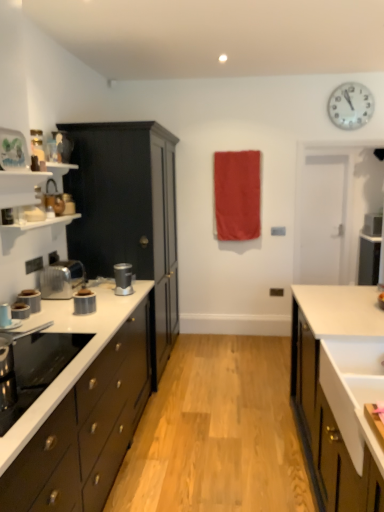
Question: Do you think matte black cabinet at left, arranged as the 2th cabinetry when viewed from the right, is within white glossy clock at upper right, or outside of it?

Choices:
 (A) outside
 (B) inside

Answer: (A)

Question: Is matte black cabinet at left, arranged as the 2th cabinetry when viewed from the right, wider or thinner than white glossy clock at upper right?

Choices:
 (A) thin
 (B) wide

Answer: (B)

Question: Estimate the real-world distances between objects in this image. Which object is closer to the white matte sink at right, positioned as the first cabinetry in right-to-left order?

Choices:
 (A) metallic silver toaster at left, which is the second kitchen appliance from front to back
 (B) matte black cabinet at left, placed as the 2th cabinetry when sorted from left to right
 (C) matte black cabinets at left, the 1th cabinetry from the left
 (D) metallic silver tape at left, arranged as the third kitchen appliance when viewed from the front
 (E) white glossy clock at upper right

Answer: (C)

Question: Which of these objects is positioned farthest from the matte black cabinet at left, placed as the 2th cabinetry when sorted from left to right?

Choices:
 (A) matte silver toaster at left, which is counted as the third kitchen appliance, starting from the back
 (B) polished stainless steel kettle at left, placed as the fifth kitchen appliance when sorted from front to back
 (C) metallic silver tape at left, arranged as the third kitchen appliance when viewed from the front
 (D) satin silver blender at center, arranged as the 6th kitchen appliance when viewed from the front
 (E) red fabric at center

Answer: (E)